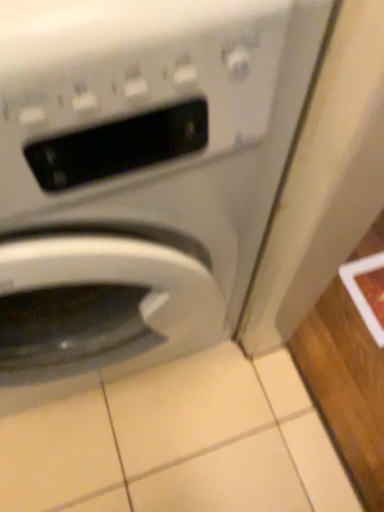
Measure the distance between point (141,315) and camera.

Point (141,315) and camera are 20.87 inches apart.

The width and height of the screenshot is (384, 512). I want to click on satin white washing machine at center, so point(137,177).

What is the approximate width of satin white washing machine at center?

satin white washing machine at center is 17.56 inches in width.

What do you see at coordinates (137, 177) in the screenshot? This screenshot has height=512, width=384. I see `satin white washing machine at center` at bounding box center [137, 177].

At what (x,y) coordinates should I click in order to perform the action: click on satin white washing machine at center. Please return your answer as a coordinate pair (x, y). The image size is (384, 512). Looking at the image, I should click on (137, 177).